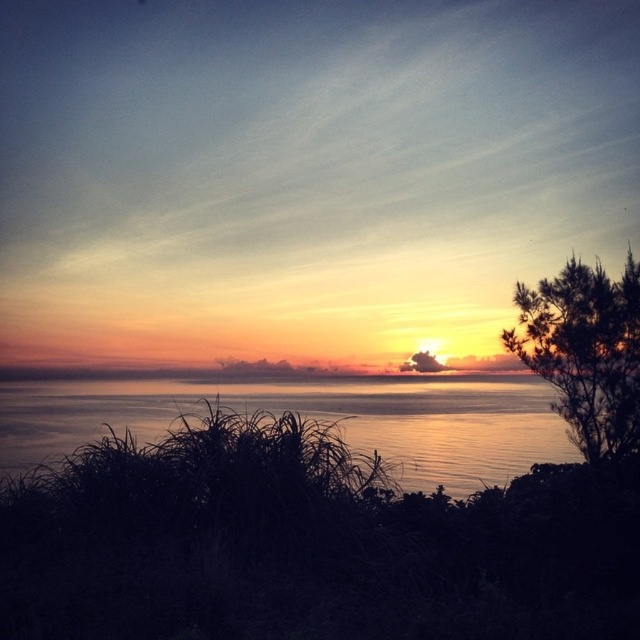
Does silky water at center come in front of green needle-like leaves at right?

Yes, silky water at center is closer to the viewer.

Find the location of a particular element. The image size is (640, 640). silky water at center is located at coordinates coord(314,417).

Where is `silky water at center`? This screenshot has height=640, width=640. silky water at center is located at coordinates (314, 417).